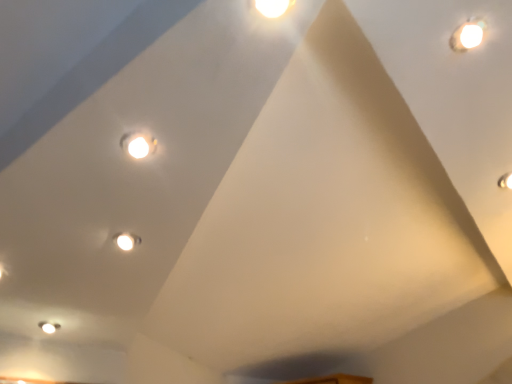
Question: From the image's perspective, is white glossy droplight at upper right above or below matte white light at upper right, placed as the second light when sorted from left to right?

Choices:
 (A) above
 (B) below

Answer: (A)

Question: From their relative heights in the image, would you say white glossy droplight at upper right is taller or shorter than matte white light at upper right, which is counted as the first light, starting from the bottom?

Choices:
 (A) tall
 (B) short

Answer: (B)

Question: Estimate the real-world distances between objects in this image. Which object is closer to the matte white light at upper center, which is the first light in left-to-right order?

Choices:
 (A) matte white light at upper right, which is counted as the first light, starting from the bottom
 (B) white glossy droplight at upper right

Answer: (B)

Question: Which is nearer to the white glossy droplight at upper right?

Choices:
 (A) matte white light at upper center, placed as the second light when sorted from back to front
 (B) matte white light at upper right, which is counted as the 1th light, starting from the right

Answer: (B)